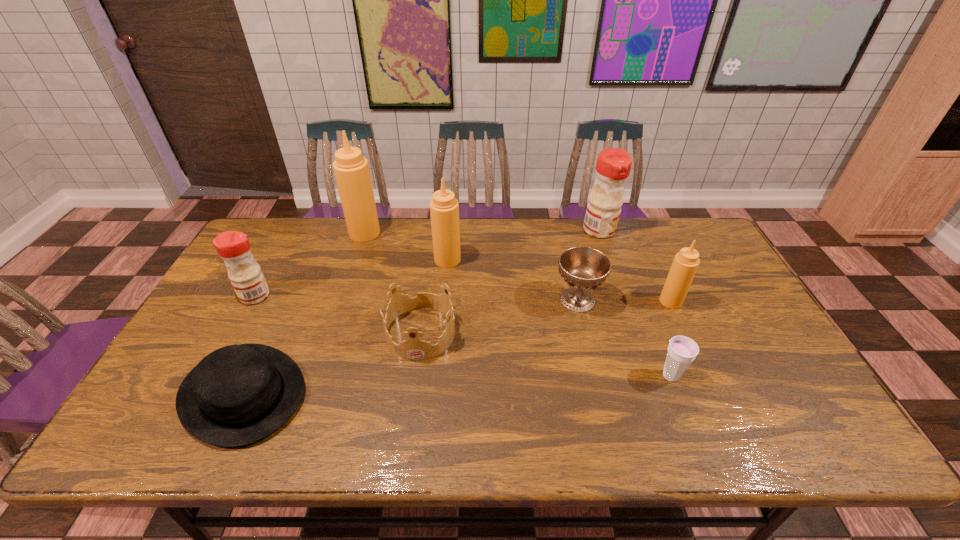
Find the location of a particular element. free space located 0.240m on the right of the smaller red condiment is located at coordinates (350, 296).

This screenshot has height=540, width=960. Find the location of `vacant space located 0.320m on the front of the red chalice`. vacant space located 0.320m on the front of the red chalice is located at coordinates (606, 420).

I want to click on blank area located 0.210m on the front-facing side of the tiara, so click(407, 436).

At what (x,y) coordinates should I click in order to perform the action: click on free spot located on the left of the purple cup. Please return your answer as a coordinate pair (x, y). This screenshot has width=960, height=540. Looking at the image, I should click on (530, 376).

Find the location of a particular element. blank area located on the right of the black fedora is located at coordinates (380, 393).

This screenshot has height=540, width=960. In order to click on object that is positioned at the near edge in this screenshot , I will do `click(239, 394)`.

Where is `condiment that is positioned at the left edge`? This screenshot has width=960, height=540. condiment that is positioned at the left edge is located at coordinates pos(248,281).

In order to click on fedora at the left edge in this screenshot , I will do `click(239, 394)`.

Where is `object situated at the near left corner`? The image size is (960, 540). object situated at the near left corner is located at coordinates (239, 394).

Where is `vacant space at the far edge of the desktop`? This screenshot has width=960, height=540. vacant space at the far edge of the desktop is located at coordinates (525, 252).